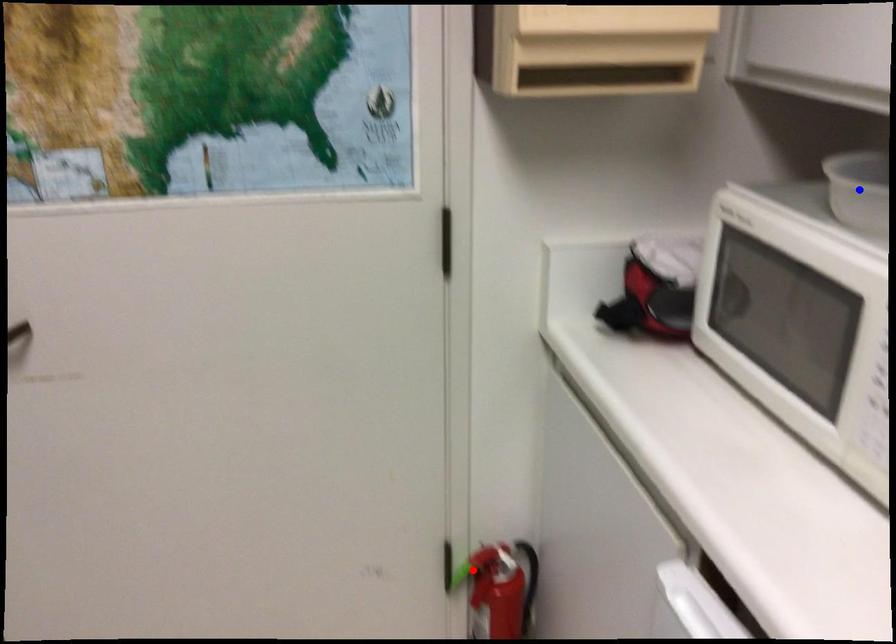
Question: In the image, two points are highlighted. Which point is nearer to the camera? Reply with the corresponding letter.

Choices:
 (A) blue point
 (B) red point

Answer: (A)